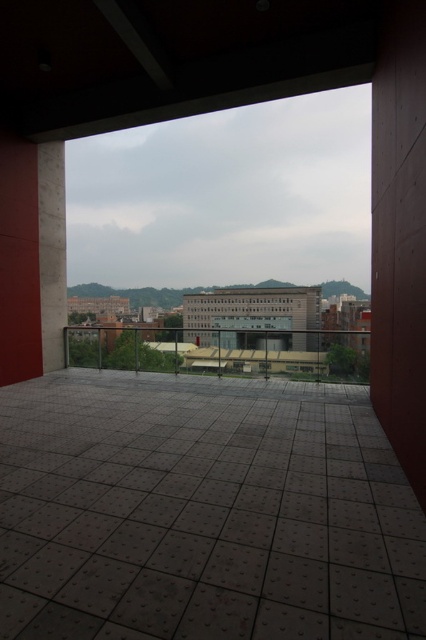
You are standing on the balcony and want to compare the two pillars supporting the structure. Which pillar is shorter between the brown wood pillar at right and the concrete pillar at left?

The brown wood pillar at right is shorter than the concrete pillar at left.

You are standing on the balcony and want to place a 3.5 meter long ladder against the brown wood pillar at right. Is there enough space between you and the pillar to safely place the ladder?

The distance between you and the brown wood pillar at right is 3.45 meters, which is slightly less than the ladder length of 3.5 meters. Therefore, there is not enough space to safely place the ladder against the pillar.